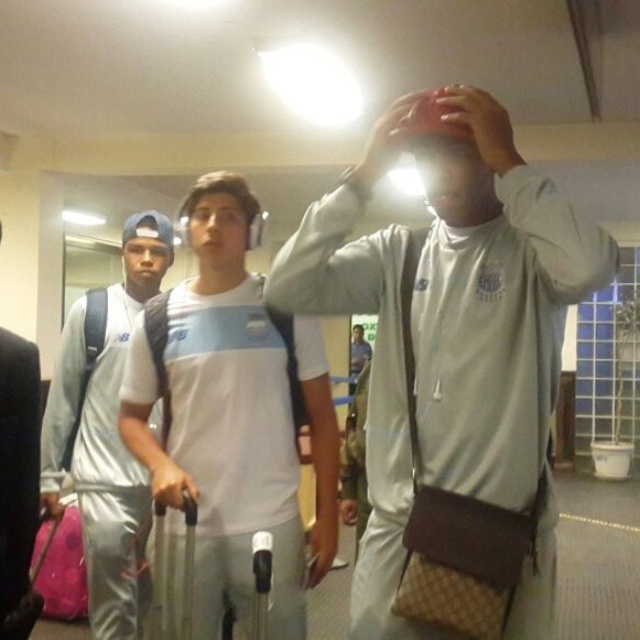
You are a photographer setting up a shoot in the scene described. You need to position a spotlight so that it illuminates both the matte black hand at upper center and the smooth skin hand at center without casting shadows over other parts of the image. Given their positions, where should you place the spotlight relative to the hands?

The matte black hand at upper center is located above the smooth skin hand at center. To avoid casting shadows, the spotlight should be placed above the matte black hand at upper center so that light falls downward onto both hands without obstructing other areas.

You are a photographer setting up a shoot in the scene. You need to ensure that both the white matte jacket at center and the white matte jersey at center are fully visible in the frame. Given their sizes, which one might require you to adjust your camera angle to avoid cropping?

The white matte jacket at center is much taller than the white matte jersey at center, so you might need to adjust the camera angle to accommodate its height to ensure it doesn

You are standing in the lobby and need to hand a package to the person in the white matte jersey at center. Which direction should you walk to approach them without passing in front of the silver metallic tracksuit at left?

You should walk around the silver metallic tracksuit at left to the right side since the silver metallic tracksuit at left is closer to the viewer than the white matte jersey at center, so moving to the right would allow you to approach the white matte jersey at center without passing directly in front.